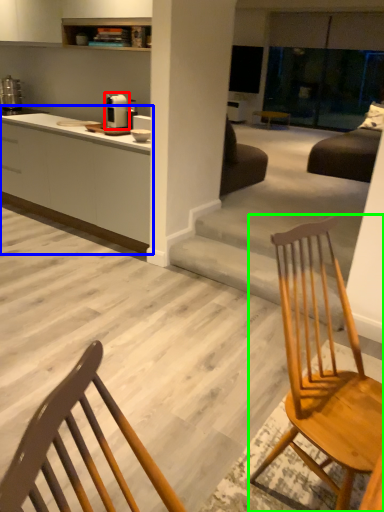
Question: Which is nearer to the appliance (highlighted by a red box)? cabinetry (highlighted by a blue box) or chair (highlighted by a green box).

Choices:
 (A) cabinetry
 (B) chair

Answer: (A)